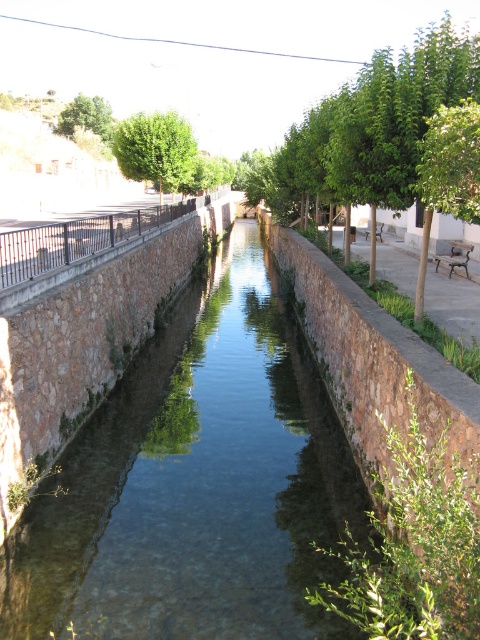
Question: Which point is farther to the camera?

Choices:
 (A) green leafy tree at upper center
 (B) clear stone stream at center
 (C) green leafy tree at upper left

Answer: (C)

Question: From the image, what is the correct spatial relationship of green leafy tree at center in relation to green leafy tree at upper center?

Choices:
 (A) right
 (B) left

Answer: (A)

Question: Estimate the real-world distances between objects in this image. Which object is closer to the clear stone stream at center?

Choices:
 (A) green leafy tree at center
 (B) green leafy tree at upper center
 (C) green leafy tree at upper left

Answer: (B)

Question: Does clear stone stream at center have a smaller size compared to green leafy tree at upper left?

Choices:
 (A) no
 (B) yes

Answer: (B)

Question: Does clear stone stream at center have a larger size compared to green leafy tree at center?

Choices:
 (A) yes
 (B) no

Answer: (B)

Question: Based on their relative distances, which object is farther from the clear stone stream at center?

Choices:
 (A) green leafy tree at center
 (B) green leafy tree at upper left
 (C) green leafy tree at upper center

Answer: (B)